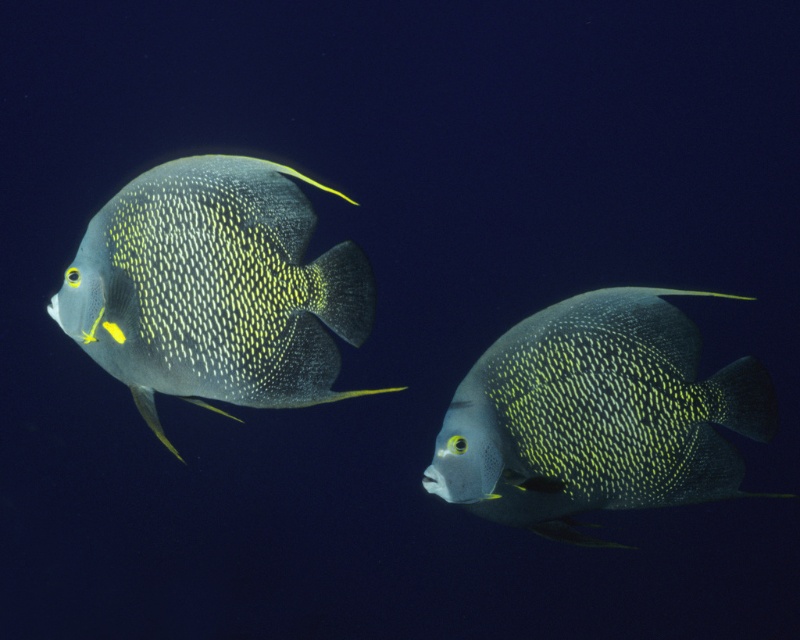
Question: Is shiny blue fish at left to the left of shiny blue fish at center from the viewer's perspective?

Choices:
 (A) yes
 (B) no

Answer: (A)

Question: Can you confirm if shiny blue fish at left is positioned to the left of shiny blue fish at center?

Choices:
 (A) yes
 (B) no

Answer: (A)

Question: Can you confirm if shiny blue fish at left is bigger than shiny blue fish at center?

Choices:
 (A) no
 (B) yes

Answer: (B)